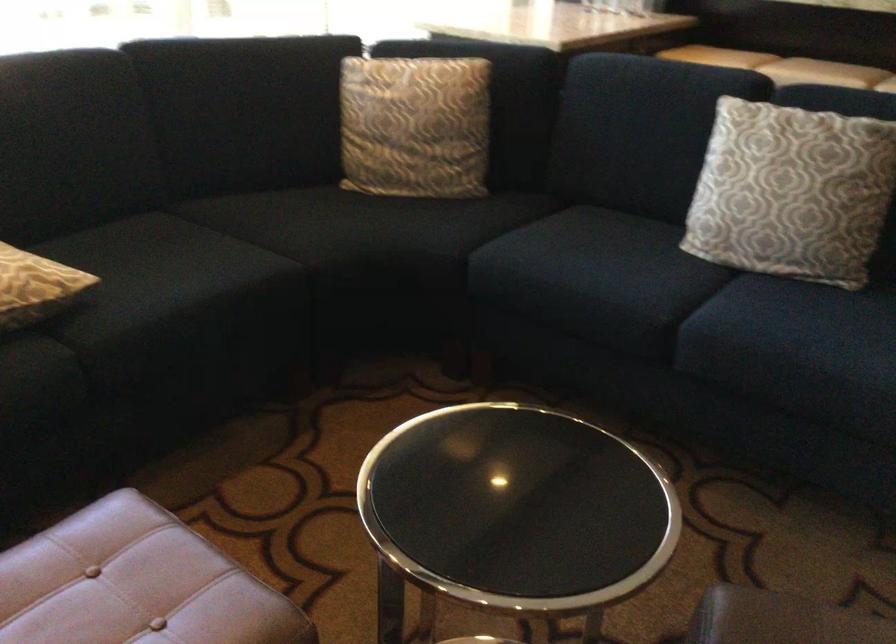
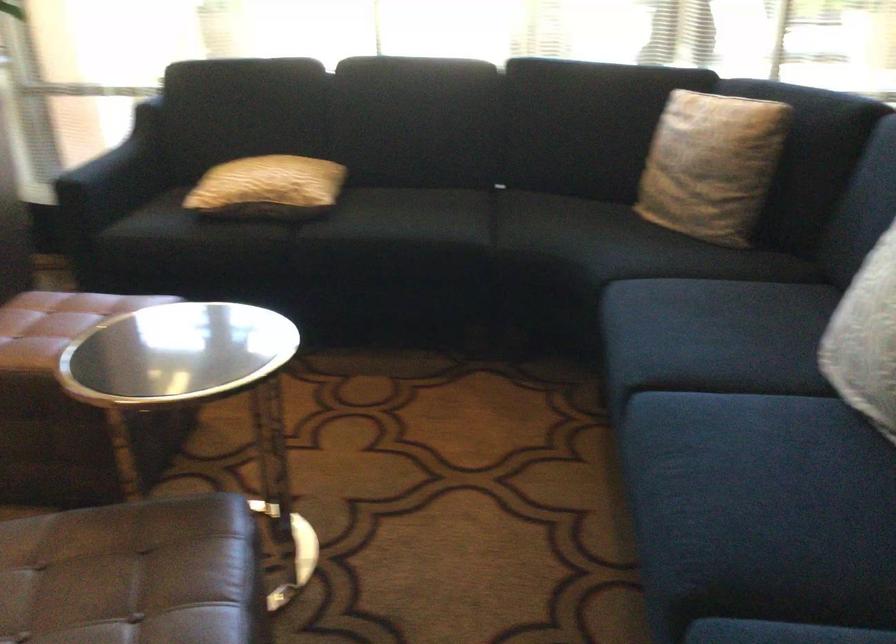
Locate, in the second image, the point that corresponds to pixel 769 225 in the first image.

(866, 339)